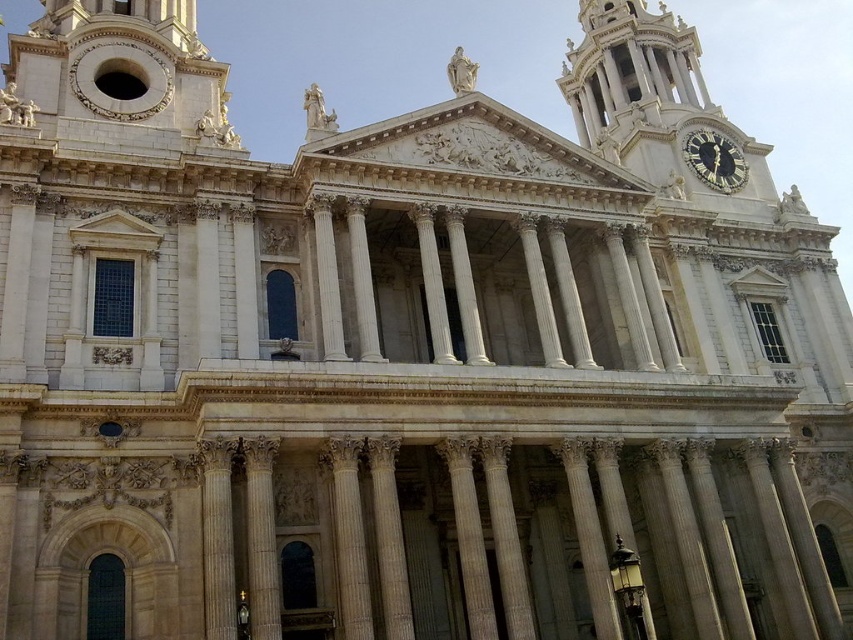
You are an architect visiting St. Paul Cathedral. You notice the white marble column at center and the gold metallic clock at upper right. Which object is positioned higher up on the cathedral facade?

The gold metallic clock at upper right is positioned higher up on the cathedral facade than the white marble column at center.

You are an architect designing a miniature model of St. Paul Cathedral. You have to place the white marble column at center and the gold metallic clock at upper right. Which object should you make wider in your model to stay true to the original building?

The gold metallic clock at upper right should be made wider in the model since it has a greater width than the white marble column at center according to the description.

You are standing directly in front of St. Pauls Cathedral and want to locate the white marble column at center. Based on its coordinates, where should you look relative to the main entrance?

The white marble column at center is located at coordinates point (x=349, y=538), which means it is positioned to the right and slightly above the center of the cathedral facade. Therefore, you should look towards the right side of the main entrance and a bit upward to find it.